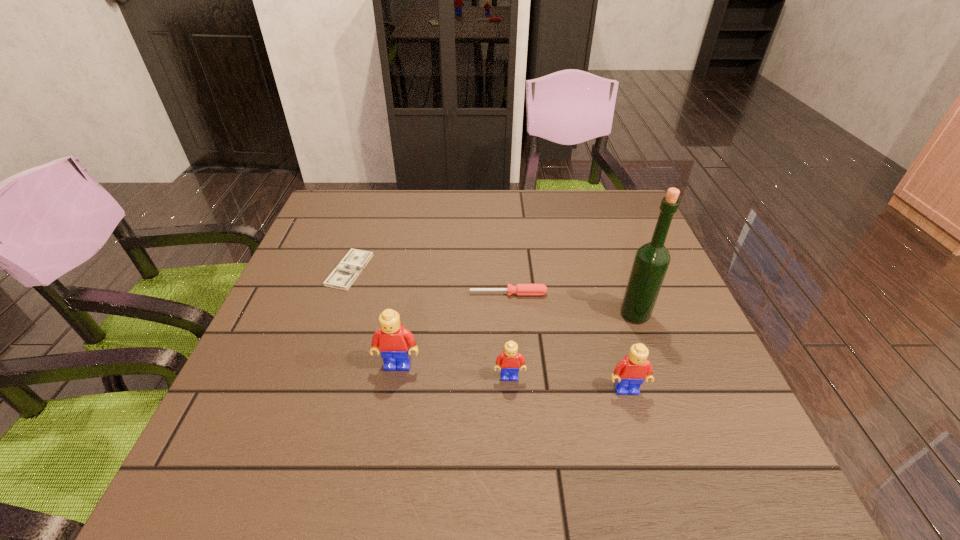
Where is `screwdriver`? This screenshot has width=960, height=540. screwdriver is located at coordinates (520, 289).

The image size is (960, 540). I want to click on vacant space situated 0.070m on the front-facing side of the fifth object from right to left, so click(392, 403).

In order to click on vacant space situated 0.070m on the front-facing side of the shortest Lego in this screenshot , I will do [512, 414].

The width and height of the screenshot is (960, 540). I want to click on free space located on the front-facing side of the third tallest object, so click(x=638, y=430).

Locate an element on the screen. vacant space located 0.220m on the left of the tallest object is located at coordinates (523, 314).

Find the location of a particular element. free space located 0.300m on the back of the dollar is located at coordinates (376, 194).

Where is `free region located 0.150m on the right of the fifth tallest object`? Image resolution: width=960 pixels, height=540 pixels. free region located 0.150m on the right of the fifth tallest object is located at coordinates (610, 294).

Identify the location of object present at the near edge. (630, 372).

Image resolution: width=960 pixels, height=540 pixels. I want to click on object that is positioned at the left edge, so click(x=342, y=277).

This screenshot has height=540, width=960. I want to click on Lego at the right edge, so click(x=630, y=372).